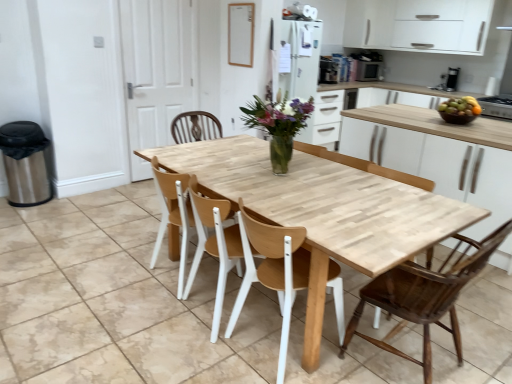
Question: Is white matte cabinet at upper right taller than metallic silver toaster at upper center, the 3th appliance positioned from the right?

Choices:
 (A) yes
 (B) no

Answer: (A)

Question: Considering the relative positions of white matte cabinet at upper right and metallic silver toaster at upper center, the second appliance in the bottom-to-top sequence, in the image provided, is white matte cabinet at upper right to the right of metallic silver toaster at upper center, the second appliance in the bottom-to-top sequence, from the viewer's perspective?

Choices:
 (A) yes
 (B) no

Answer: (A)

Question: Is the depth of white matte cabinet at upper right less than that of metallic silver toaster at upper center, the second appliance in the bottom-to-top sequence?

Choices:
 (A) no
 (B) yes

Answer: (A)

Question: From a real-world perspective, does white matte cabinet at upper right sit lower than metallic silver toaster at upper center, marked as the second appliance in a top-to-bottom arrangement?

Choices:
 (A) yes
 (B) no

Answer: (B)

Question: Can you confirm if white matte cabinet at upper right is thinner than metallic silver toaster at upper center, acting as the second appliance starting from the front?

Choices:
 (A) no
 (B) yes

Answer: (A)

Question: Do you think shiny brown bowl at right is within white matte cabinet at upper right, or outside of it?

Choices:
 (A) outside
 (B) inside

Answer: (A)

Question: From a real-world perspective, is shiny brown bowl at right physically located above or below white matte cabinet at upper right?

Choices:
 (A) below
 (B) above

Answer: (A)

Question: From the image's perspective, relative to white matte cabinet at upper right, is shiny brown bowl at right above or below?

Choices:
 (A) above
 (B) below

Answer: (B)

Question: Considering their positions, is shiny brown bowl at right located in front of or behind white matte cabinet at upper right?

Choices:
 (A) behind
 (B) front

Answer: (B)

Question: Based on their sizes in the image, would you say shiny brown bowl at right is bigger or smaller than dark brown wood chair at center, which is the third chair in left-to-right order?

Choices:
 (A) small
 (B) big

Answer: (A)

Question: From a real-world perspective, relative to dark brown wood chair at center, acting as the first chair starting from the right, is shiny brown bowl at right vertically above or below?

Choices:
 (A) above
 (B) below

Answer: (A)

Question: From the image's perspective, relative to dark brown wood chair at center, which is the third chair in left-to-right order, is shiny brown bowl at right above or below?

Choices:
 (A) above
 (B) below

Answer: (A)

Question: Would you say shiny brown bowl at right is to the left or to the right of dark brown wood chair at center, acting as the first chair starting from the right, in the picture?

Choices:
 (A) left
 (B) right

Answer: (B)

Question: From the image's perspective, relative to light wood table at center, is shiny brown bowl at right above or below?

Choices:
 (A) below
 (B) above

Answer: (B)

Question: Is shiny brown bowl at right in front of or behind light wood table at center in the image?

Choices:
 (A) behind
 (B) front

Answer: (A)